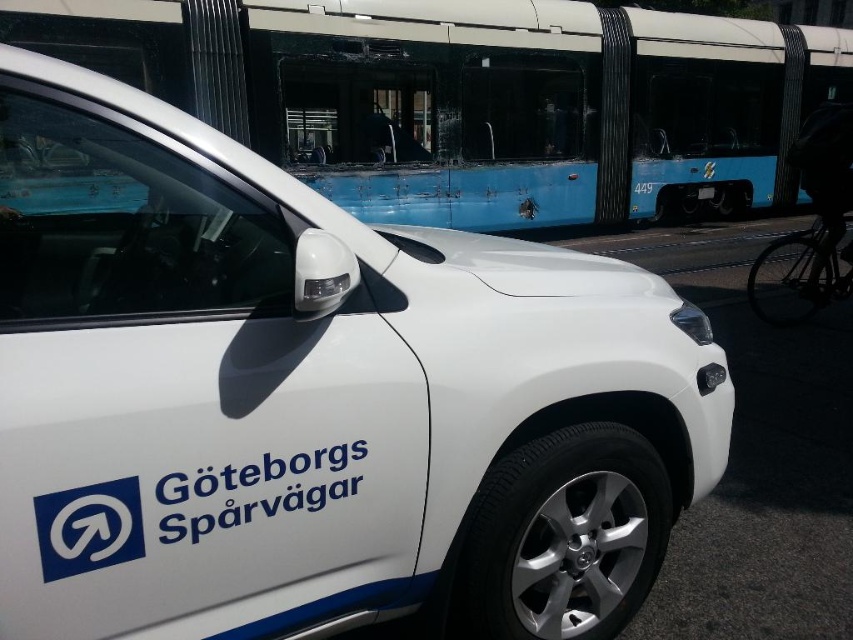
Question: Is blue matte bus at upper center further to camera compared to shiny black bicycle at right?

Choices:
 (A) yes
 (B) no

Answer: (A)

Question: Does blue matte bus at upper center appear on the right side of shiny black bicycle at right?

Choices:
 (A) yes
 (B) no

Answer: (B)

Question: Does blue matte bus at upper center have a lesser width compared to shiny black bicycle at right?

Choices:
 (A) yes
 (B) no

Answer: (B)

Question: Which of the following is the farthest from the observer?

Choices:
 (A) blue matte bus at upper center
 (B) shiny black bicycle at right
 (C) black plastic license plate at center

Answer: (C)

Question: Which object is closer to the camera taking this photo?

Choices:
 (A) black plastic license plate at center
 (B) blue matte bus at upper center

Answer: (B)

Question: Which object is the closest to the shiny black bicycle at right?

Choices:
 (A) black plastic license plate at center
 (B) blue matte bus at upper center

Answer: (A)